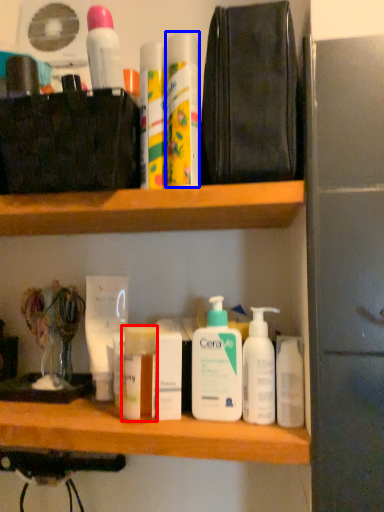
Question: Which point is further to the camera, toiletry (highlighted by a red box) or mouthwash (highlighted by a blue box)?

Choices:
 (A) toiletry
 (B) mouthwash

Answer: (A)